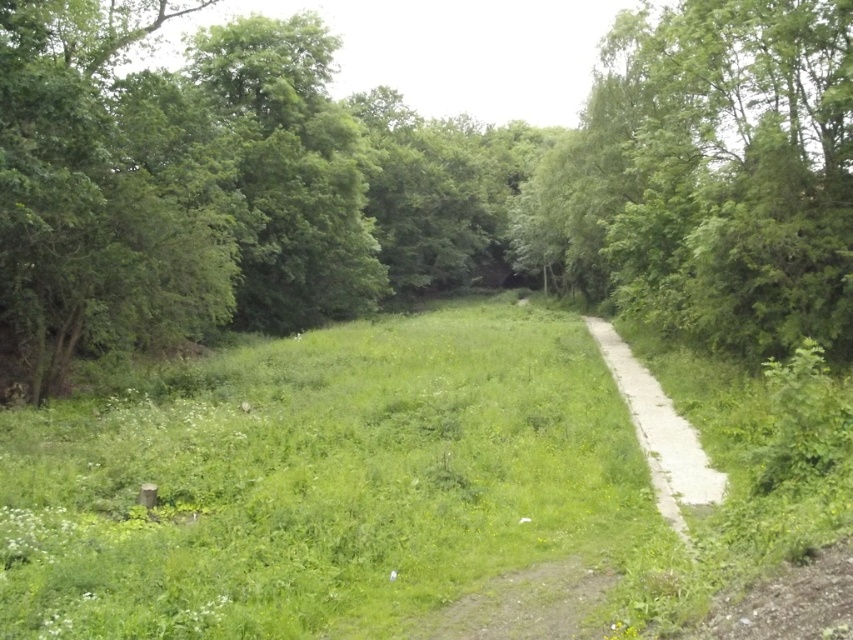
Find the location of `green leafy tree at center`. green leafy tree at center is located at coordinates (415, 180).

Can you confirm if green leafy tree at center is positioned to the left of brown gravel path at center?

Indeed, green leafy tree at center is positioned on the left side of brown gravel path at center.

Which is behind, point (234, 257) or point (564, 566)?

Positioned behind is point (234, 257).

The image size is (853, 640). Identify the location of green leafy tree at center. (415, 180).

Is brown gravel path at center shorter than white gravel path at center?

Yes, brown gravel path at center is shorter than white gravel path at center.

Is point (508, 589) closer to viewer compared to point (674, 484)?

Yes, it is in front of point (674, 484).

Is point (465, 632) positioned in front of point (679, 456)?

Yes, point (465, 632) is closer to viewer.

Locate an element on the screen. The image size is (853, 640). brown gravel path at center is located at coordinates 521,604.

Between point (202, 36) and point (592, 330), which one is positioned behind?

Point (202, 36)

Which of these two, green leafy tree at center or white gravel path at center, stands taller?

Standing taller between the two is green leafy tree at center.

Locate an element on the screen. green leafy tree at center is located at coordinates (415, 180).